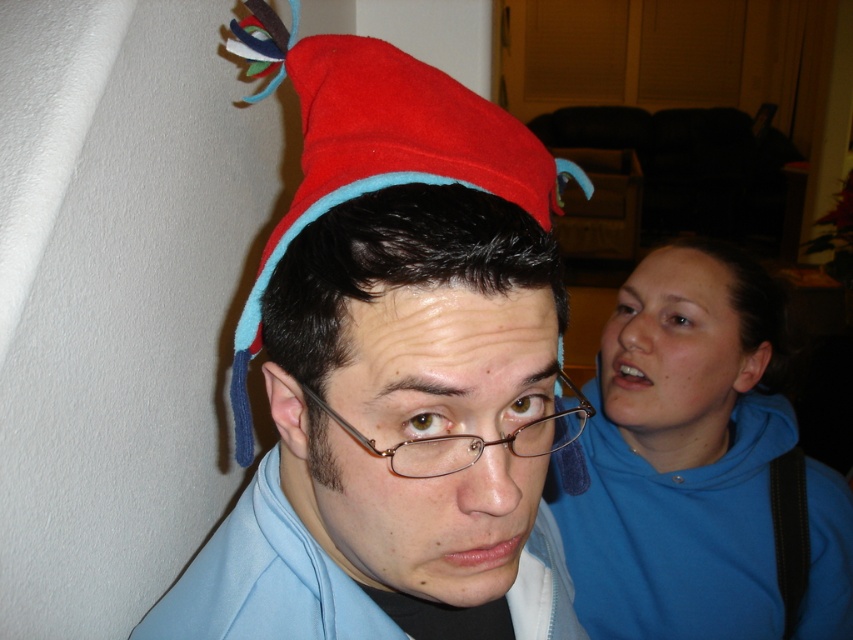
Is red felt hat at center positioned before light blue fleece sweatshirt at center?

Yes, it is.

Based on the photo, who is shorter, red felt hat at center or light blue fleece sweatshirt at center?

light blue fleece sweatshirt at center is shorter.

This screenshot has height=640, width=853. In order to click on red felt hat at center in this screenshot , I will do `click(376, 147)`.

Which is more to the left, blue fleece sweatshirt at upper right or light blue fleece sweatshirt at center?

light blue fleece sweatshirt at center

Based on the photo, is blue fleece sweatshirt at upper right shorter than light blue fleece sweatshirt at center?

No, blue fleece sweatshirt at upper right is not shorter than light blue fleece sweatshirt at center.

Describe the element at coordinates (682, 452) in the screenshot. I see `blue fleece sweatshirt at upper right` at that location.

Where is `blue fleece sweatshirt at upper right`? The height and width of the screenshot is (640, 853). blue fleece sweatshirt at upper right is located at coordinates (682, 452).

Does blue fleece sweatshirt at upper right appear on the right side of red felt hat at center?

Correct, you'll find blue fleece sweatshirt at upper right to the right of red felt hat at center.

Is blue fleece sweatshirt at upper right smaller than red felt hat at center?

No, blue fleece sweatshirt at upper right is not smaller than red felt hat at center.

Between point (602, 566) and point (346, 36), which one is positioned in front?

Point (346, 36) is more forward.

Where is `blue fleece sweatshirt at upper right`? The height and width of the screenshot is (640, 853). blue fleece sweatshirt at upper right is located at coordinates point(682,452).